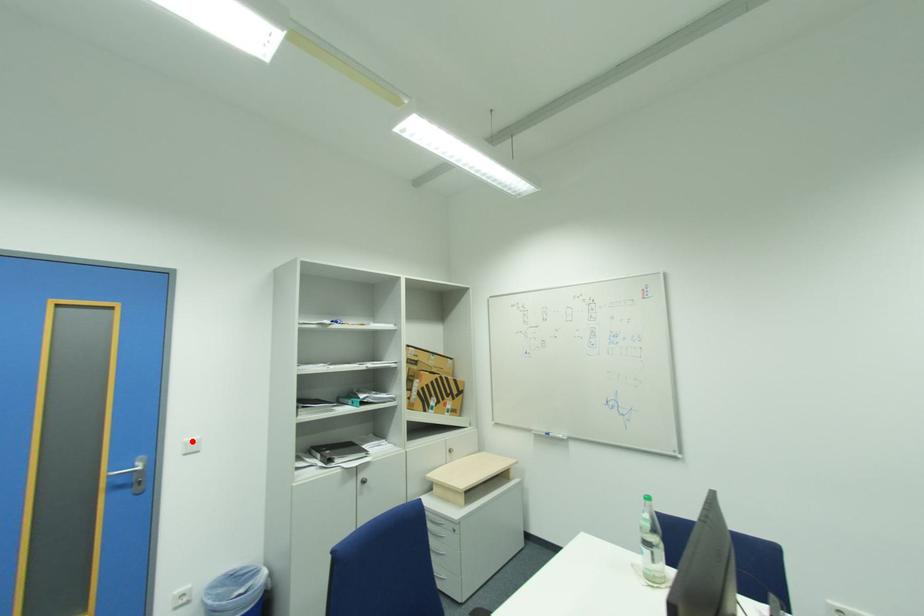
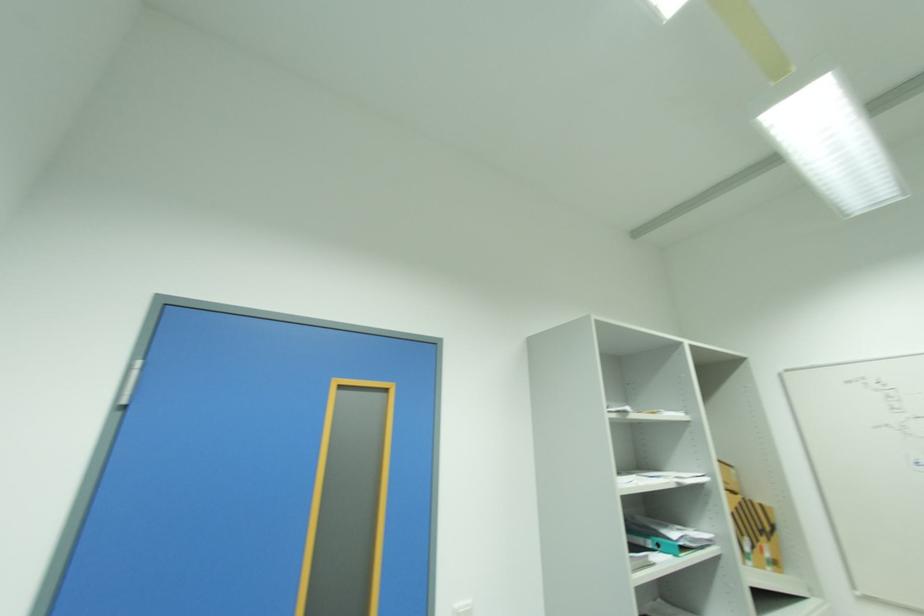
The point at the highlighted location is marked in the first image. Where is the corresponding point in the second image?

(463, 604)